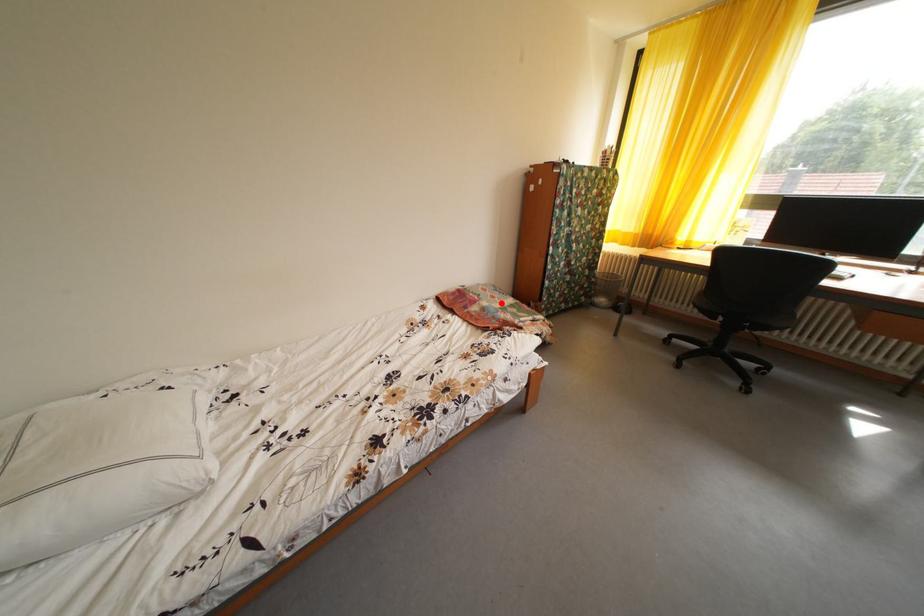
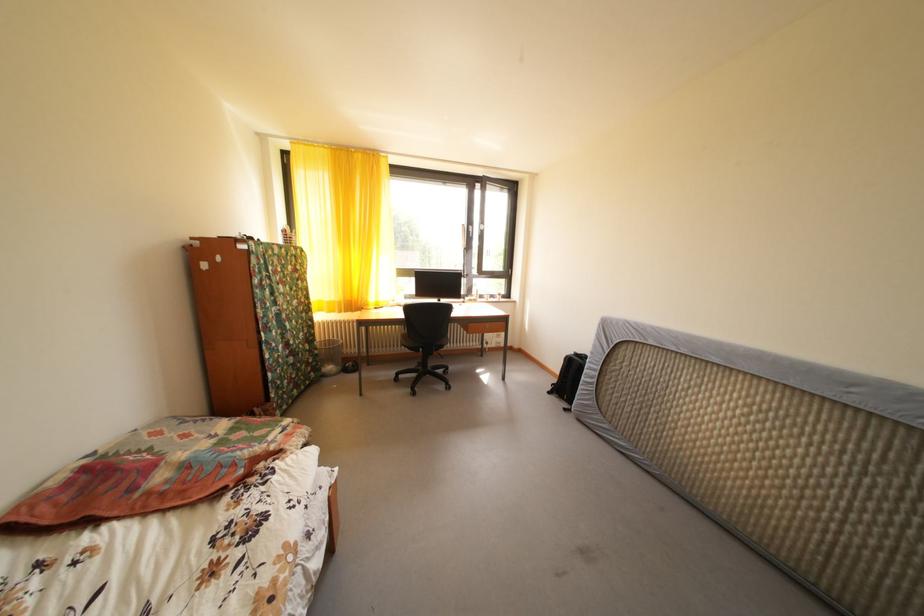
Find the pixel in the second image that matches the highlighted location in the first image.

(195, 442)